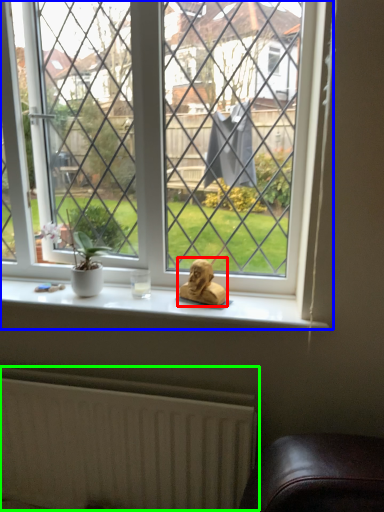
Question: Which object is the closest to the animal (highlighted by a red box)? Choose among these: window (highlighted by a blue box) or radiator (highlighted by a green box).

Choices:
 (A) window
 (B) radiator

Answer: (A)